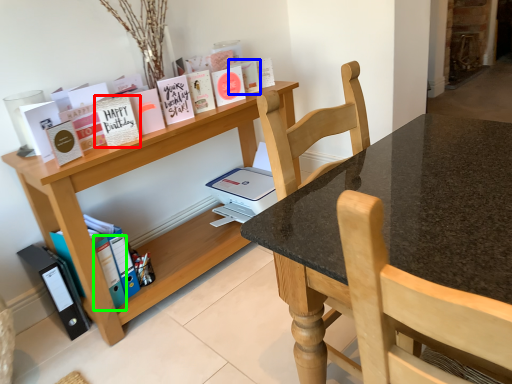
Question: Estimate the real-world distances between objects in this image. Which object is farther from paperback book (highlighted by a red box), paperback book (highlighted by a blue box) or paperback book (highlighted by a green box)?

Choices:
 (A) paperback book
 (B) paperback book

Answer: (A)